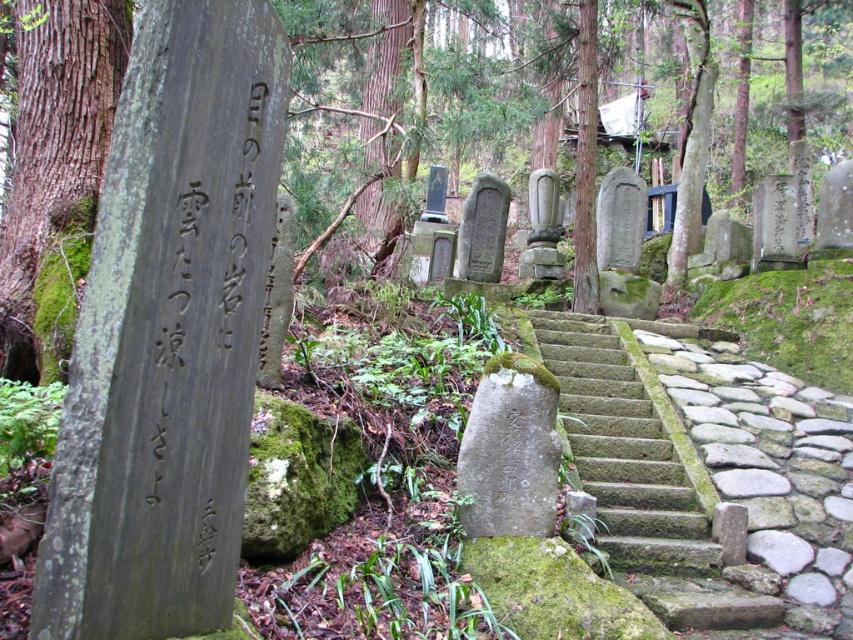
You are a visitor at the grave site and want to place a flower on the tallest object between the smooth gray stone at center and the gray stone gravestone at center. Which object should you choose?

The smooth gray stone at center is taller than the gray stone gravestone at center, so you should place the flower on the smooth gray stone at center.

You are a hiker navigating the mossy path and need to step onto the green mossy stone at left and the green mossy stone stairs at center. Which one should you step on first if you want to reach higher ground?

The green mossy stone at left is taller than the green mossy stone stairs at center, so you should step on the green mossy stone at left first to reach higher ground.

You are standing at the entrance of the forest and see a point marked at coordinates (55,124). According to the scene description, where exactly is this point located?

The point is located on a green mossy stone at the left side of the scene.